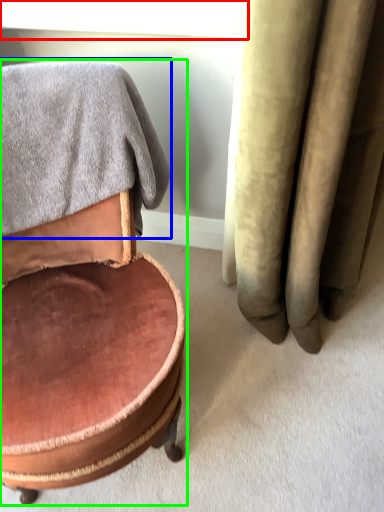
Question: Which is farther away from window screen (highlighted by a red box)? bath towel (highlighted by a blue box) or chair (highlighted by a green box)?

Choices:
 (A) bath towel
 (B) chair

Answer: (B)